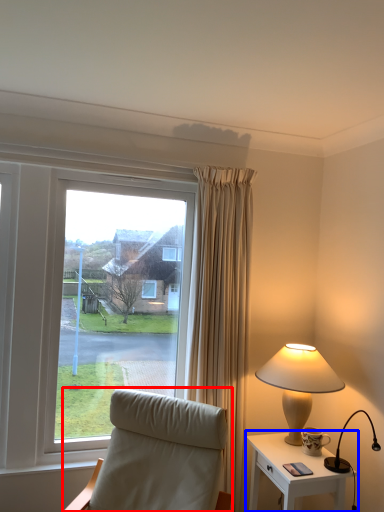
Question: Among these objects, which one is farthest to the camera, chair (highlighted by a red box) or nightstand (highlighted by a blue box)?

Choices:
 (A) chair
 (B) nightstand

Answer: (B)